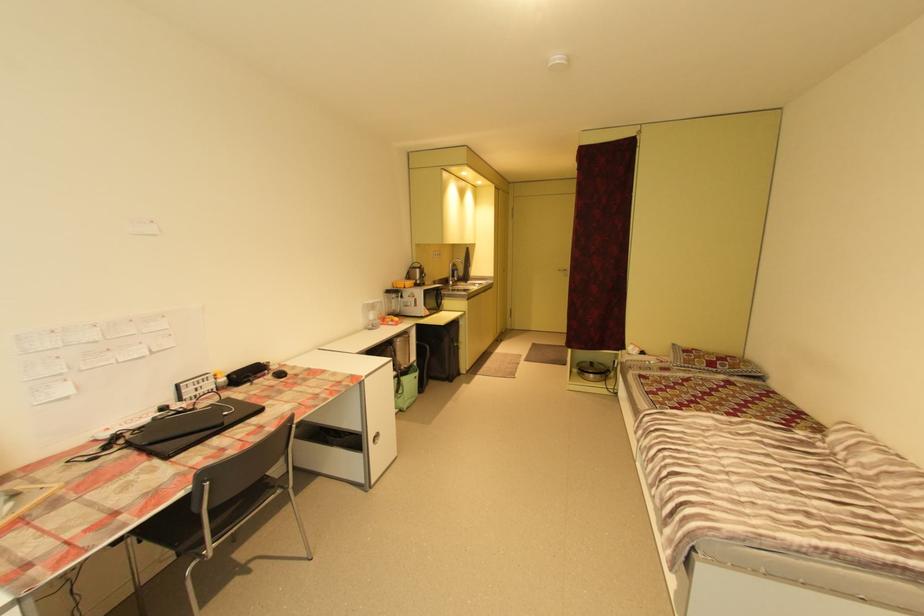
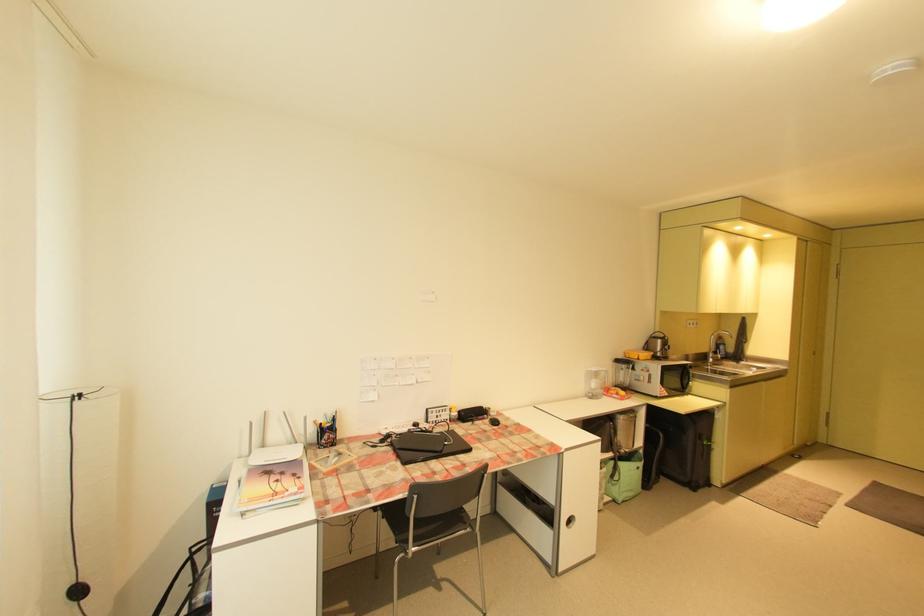
The point at (458,277) is marked in the first image. Where is the corresponding point in the second image?

(722, 353)